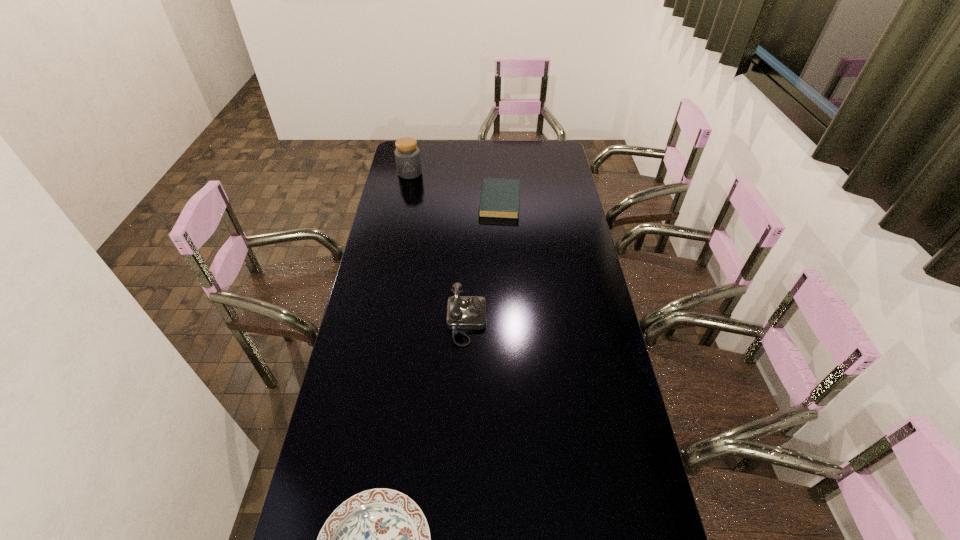
This screenshot has height=540, width=960. In the image, there is a desktop. In order to click on vacant space at the left edge in this screenshot , I will do `click(325, 467)`.

The width and height of the screenshot is (960, 540). In the image, there is a desktop. Identify the location of vacant area at the right edge. (595, 309).

Find the location of a particular element. The width and height of the screenshot is (960, 540). free space between the book and the jar is located at coordinates (455, 187).

Find the location of `vacant space that's between the second tallest object and the second farthest object`. vacant space that's between the second tallest object and the second farthest object is located at coordinates (483, 261).

Identify the location of vacant point located between the telephone and the farthest object. (438, 247).

Where is `empty space that is in between the tallest object and the third farthest object`? empty space that is in between the tallest object and the third farthest object is located at coordinates (x=438, y=247).

Select which object appears as the closest to the third nearest object. Please provide its 2D coordinates. Your answer should be formatted as a tuple, i.e. [(x, y)], where the tuple contains the x and y coordinates of a point satisfying the conditions above.

[(407, 155)]

Identify which object is the nearest to the third nearest object. Please provide its 2D coordinates. Your answer should be formatted as a tuple, i.e. [(x, y)], where the tuple contains the x and y coordinates of a point satisfying the conditions above.

[(407, 155)]

In order to click on blank area in the image that satisfies the following two spatial constraints: 1. on the front side of the third nearest object; 2. on the dial of the second tallest object in this screenshot , I will do `click(506, 322)`.

Where is `free spot that satisfies the following two spatial constraints: 1. on the surface of the third nearest object near the warning symbol; 2. on the left side of the tallest object`? free spot that satisfies the following two spatial constraints: 1. on the surface of the third nearest object near the warning symbol; 2. on the left side of the tallest object is located at coordinates (404, 201).